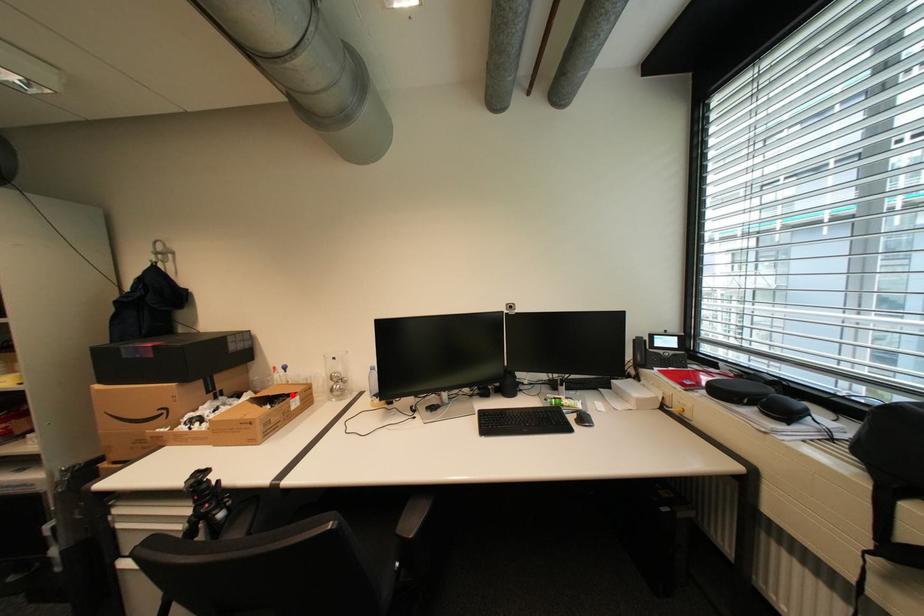
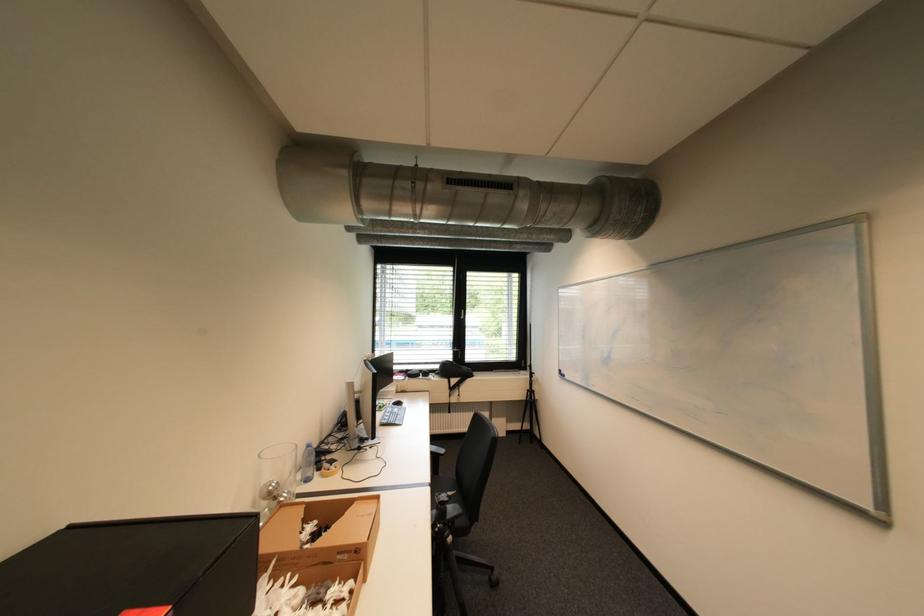
The point at the highlighted location is marked in the first image. Where is the corresponding point in the second image?

(311, 520)